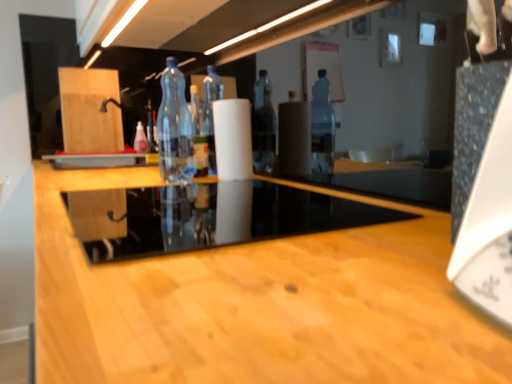
Question: Is transparent glass table at center oriented away from transparent plastic bottle at center, the 1th bottle when ordered from right to left?

Choices:
 (A) yes
 (B) no

Answer: (B)

Question: Is transparent glass table at center further to camera compared to transparent plastic bottle at center, which appears as the 1th bottle when viewed from the front?

Choices:
 (A) yes
 (B) no

Answer: (B)

Question: From a real-world perspective, is transparent glass table at center located beneath transparent plastic bottle at center, placed as the second bottle when sorted from left to right?

Choices:
 (A) yes
 (B) no

Answer: (A)

Question: From the image's perspective, is transparent glass table at center below transparent plastic bottle at center, placed as the second bottle when sorted from left to right?

Choices:
 (A) yes
 (B) no

Answer: (A)

Question: From a real-world perspective, is transparent glass table at center on transparent plastic bottle at center, placed as the second bottle when sorted from left to right?

Choices:
 (A) no
 (B) yes

Answer: (A)

Question: Is point (168, 167) positioned closer to the camera than point (138, 139)?

Choices:
 (A) farther
 (B) closer

Answer: (B)

Question: From a real-world perspective, is transparent plastic bottle at center, which appears as the 1th bottle when viewed from the front, physically located above or below pink plastic bottle at center, marked as the 2th bottle in a right-to-left arrangement?

Choices:
 (A) above
 (B) below

Answer: (A)

Question: Which is correct: transparent plastic bottle at center, the 1th bottle when ordered from right to left, is inside pink plastic bottle at center, the first bottle from the left, or outside of it?

Choices:
 (A) outside
 (B) inside

Answer: (A)

Question: Is transparent plastic bottle at center, the 1th bottle when ordered from right to left, to the left or to the right of pink plastic bottle at center, the first bottle from the back, in the image?

Choices:
 (A) right
 (B) left

Answer: (A)

Question: Looking at their shapes, would you say white matte paper towel at center is wider or thinner than transparent plastic bottle at center, the 1th bottle when ordered from right to left?

Choices:
 (A) thin
 (B) wide

Answer: (B)

Question: Is white matte paper towel at center bigger or smaller than transparent plastic bottle at center, which ranks as the 2th bottle in back-to-front order?

Choices:
 (A) big
 (B) small

Answer: (B)

Question: Does point [x=240, y=168] appear closer or farther from the camera than point [x=164, y=89]?

Choices:
 (A) farther
 (B) closer

Answer: (A)

Question: From a real-world perspective, relative to transparent plastic bottle at center, the 1th bottle when ordered from right to left, is white matte paper towel at center vertically above or below?

Choices:
 (A) below
 (B) above

Answer: (A)

Question: Is transparent glass table at center situated inside pink plastic bottle at center, which is the second bottle from front to back, or outside?

Choices:
 (A) inside
 (B) outside

Answer: (B)

Question: Considering the relative positions of transparent glass table at center and pink plastic bottle at center, which is the second bottle from front to back, in the image provided, is transparent glass table at center to the left or to the right of pink plastic bottle at center, which is the second bottle from front to back,?

Choices:
 (A) right
 (B) left

Answer: (A)